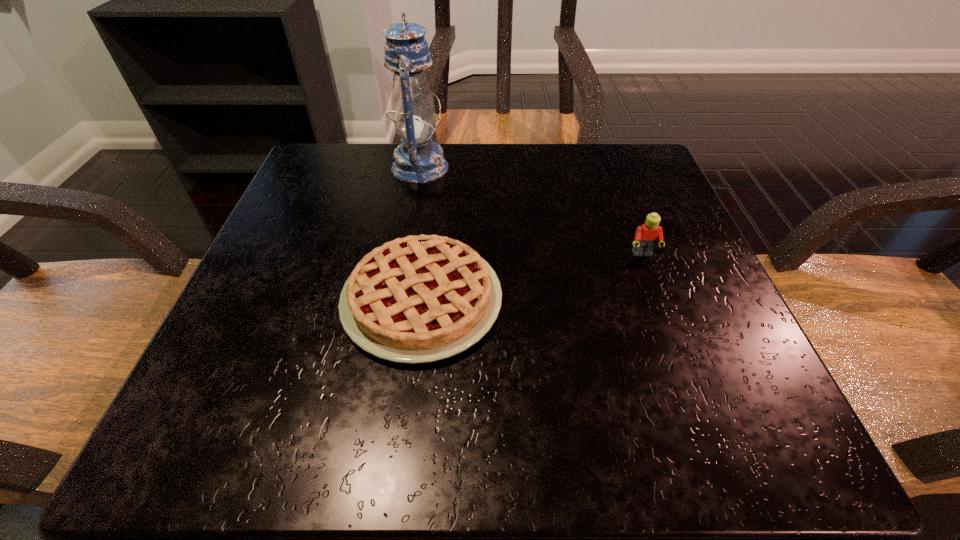
Identify the location of free region that satisfies the following two spatial constraints: 1. on the back side of the shortest object; 2. on the front-facing side of the tallest object. (438, 167).

This screenshot has width=960, height=540. I want to click on vacant region that satisfies the following two spatial constraints: 1. on the back side of the shortest object; 2. on the front-facing side of the tallest object, so click(x=438, y=167).

What are the coordinates of `free space that satisfies the following two spatial constraints: 1. on the back side of the pie; 2. on the front-facing side of the lantern` in the screenshot? It's located at (438, 167).

Where is `free space that satisfies the following two spatial constraints: 1. on the front-facing side of the farthest object; 2. on the back side of the pie`? The image size is (960, 540). free space that satisfies the following two spatial constraints: 1. on the front-facing side of the farthest object; 2. on the back side of the pie is located at coordinates (397, 300).

You are a GUI agent. You are given a task and a screenshot of the screen. Output one action in this format:
    pyautogui.click(x=<x>, y=<y>)
    Task: Click on the free space that satisfies the following two spatial constraints: 1. on the front-facing side of the lantern; 2. on the right side of the pie
    
    Given the screenshot: What is the action you would take?
    pyautogui.click(x=397, y=300)

At what (x,y) coordinates should I click in order to perform the action: click on vacant space that satisfies the following two spatial constraints: 1. on the front-facing side of the pie; 2. on the right side of the tallest object. Please return your answer as a coordinate pair (x, y). The width and height of the screenshot is (960, 540). Looking at the image, I should click on click(397, 300).

I want to click on free point that satisfies the following two spatial constraints: 1. on the back side of the pie; 2. on the front-facing side of the farthest object, so click(438, 167).

At what (x,y) coordinates should I click in order to perform the action: click on vacant space that satisfies the following two spatial constraints: 1. on the front-facing side of the farthest object; 2. on the right side of the shortest object. Please return your answer as a coordinate pair (x, y). This screenshot has width=960, height=540. Looking at the image, I should click on (397, 300).